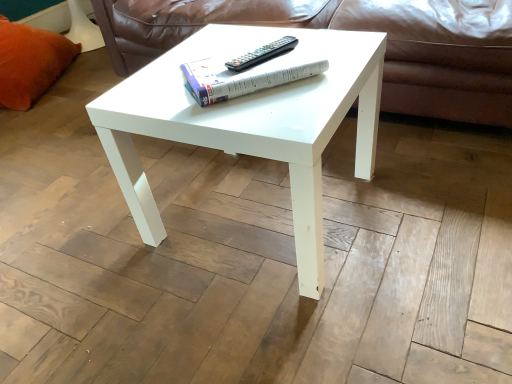
Find the location of a particular element. vacant area in front of white glossy coffee table at center is located at coordinates (290, 319).